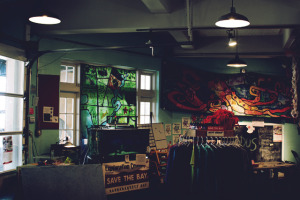
This screenshot has height=200, width=300. I want to click on hangers, so click(224, 138), click(214, 139), click(209, 139), click(203, 141), click(187, 137).